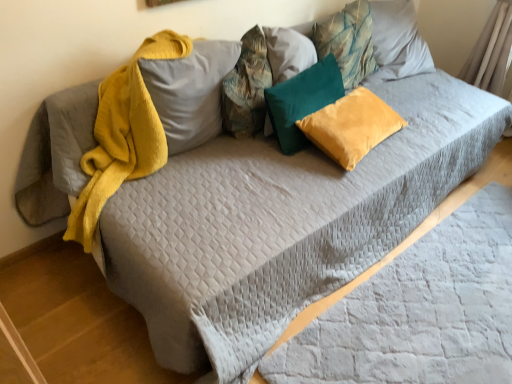
Question: In which direction should I rotate to look at teal fabric pillow at upper center, placed as the 5th pillow when sorted from left to right?

Choices:
 (A) left
 (B) right

Answer: (B)

Question: Does gray quilted sheet at lower right have a greater height compared to fuzzy yellow pillow at upper center, which is the first pillow from left to right?

Choices:
 (A) yes
 (B) no

Answer: (B)

Question: Can you confirm if gray quilted sheet at lower right is positioned to the left of fuzzy yellow pillow at upper center, which ranks as the 5th pillow in right-to-left order?

Choices:
 (A) yes
 (B) no

Answer: (B)

Question: Is fuzzy yellow pillow at upper center, which is the first pillow from left to right, surrounded by gray quilted sheet at lower right?

Choices:
 (A) no
 (B) yes

Answer: (A)

Question: From the image's perspective, is gray quilted sheet at lower right over fuzzy yellow pillow at upper center, which ranks as the 5th pillow in right-to-left order?

Choices:
 (A) yes
 (B) no

Answer: (B)

Question: Considering the relative sizes of gray quilted sheet at lower right and fuzzy yellow pillow at upper center, which is the first pillow from left to right, in the image provided, is gray quilted sheet at lower right shorter than fuzzy yellow pillow at upper center, which is the first pillow from left to right,?

Choices:
 (A) no
 (B) yes

Answer: (B)

Question: From a real-world perspective, is gray quilted sheet at lower right below fuzzy yellow pillow at upper center, which is the first pillow from left to right?

Choices:
 (A) no
 (B) yes

Answer: (B)

Question: Is velvet yellow pillow at center, which is the second pillow in right-to-left order, located outside fuzzy yellow pillow at upper center, which ranks as the 5th pillow in right-to-left order?

Choices:
 (A) no
 (B) yes

Answer: (B)

Question: From the image's perspective, would you say velvet yellow pillow at center, which is the second pillow in right-to-left order, is shown under fuzzy yellow pillow at upper center, which ranks as the 5th pillow in right-to-left order?

Choices:
 (A) no
 (B) yes

Answer: (B)

Question: Is velvet yellow pillow at center, placed as the fourth pillow when sorted from left to right, with fuzzy yellow pillow at upper center, which ranks as the 5th pillow in right-to-left order?

Choices:
 (A) no
 (B) yes

Answer: (A)

Question: Does velvet yellow pillow at center, placed as the fourth pillow when sorted from left to right, appear on the right side of fuzzy yellow pillow at upper center, which ranks as the 5th pillow in right-to-left order?

Choices:
 (A) yes
 (B) no

Answer: (A)

Question: From the image's perspective, would you say velvet yellow pillow at center, which is the second pillow in right-to-left order, is positioned over fuzzy yellow pillow at upper center, which is the first pillow from left to right?

Choices:
 (A) yes
 (B) no

Answer: (B)

Question: Can fuzzy yellow pillow at upper center, which is the first pillow from left to right, be found inside velvet yellow pillow at center, placed as the fourth pillow when sorted from left to right?

Choices:
 (A) no
 (B) yes

Answer: (A)

Question: Does velvet yellow pillow at center, which is the second pillow in right-to-left order, have a greater width compared to teal velvet pillow at center, which ranks as the 3th pillow in left-to-right order?

Choices:
 (A) no
 (B) yes

Answer: (B)